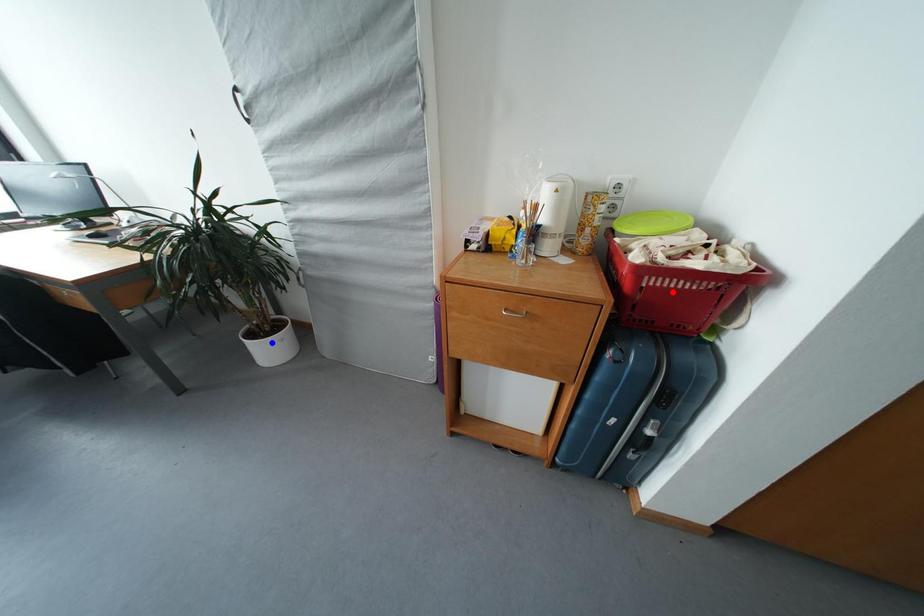
Question: In the image, two points are highlighted. Which point is nearer to the camera? Reply with the corresponding letter.

Choices:
 (A) blue point
 (B) red point

Answer: (B)